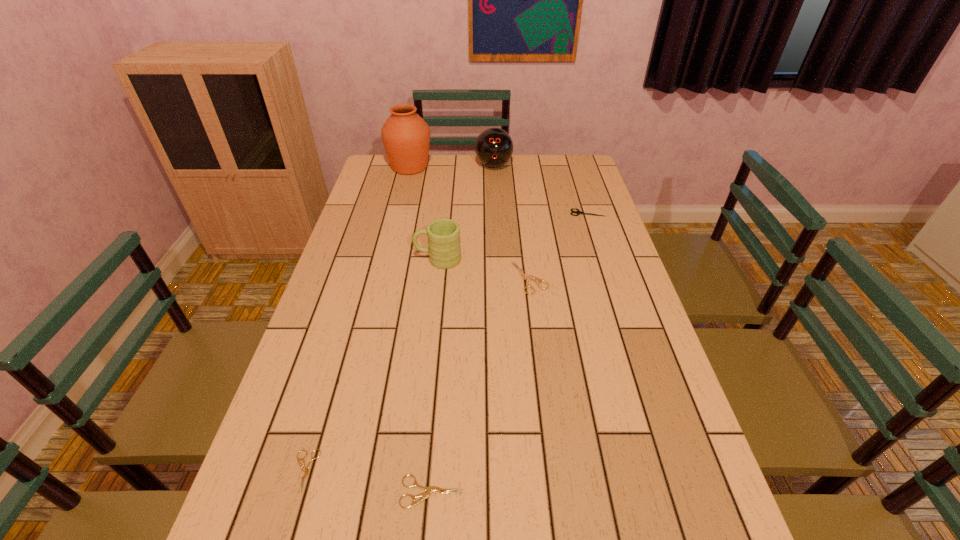
Where is `the second shortest object`? This screenshot has height=540, width=960. the second shortest object is located at coordinates (430, 489).

Locate an element on the screen. This screenshot has width=960, height=540. the second smallest beige shears is located at coordinates (430, 489).

At what (x,y) coordinates should I click in order to perform the action: click on the leftmost beige shears. Please return your answer as a coordinate pair (x, y). Looking at the image, I should click on (306, 469).

This screenshot has height=540, width=960. I want to click on the leftmost shears, so click(x=306, y=469).

Locate an element on the screen. Image resolution: width=960 pixels, height=540 pixels. free space located on the right of the brown urn is located at coordinates (520, 167).

At what (x,y) coordinates should I click in order to perform the action: click on free space located 0.080m on the surface of the black bowling ball near the finger holes. Please return your answer as a coordinate pair (x, y). This screenshot has width=960, height=540. Looking at the image, I should click on (494, 185).

This screenshot has height=540, width=960. Find the location of `free spot located 0.060m on the side of the mug with the handle`. free spot located 0.060m on the side of the mug with the handle is located at coordinates (396, 259).

What are the coordinates of `vacant position located on the side of the mug with the handle` in the screenshot? It's located at (386, 259).

This screenshot has width=960, height=540. Identify the location of blank area located on the side of the mug with the handle. (356, 259).

Image resolution: width=960 pixels, height=540 pixels. Identify the location of free region located 0.100m on the left of the black shears. (541, 213).